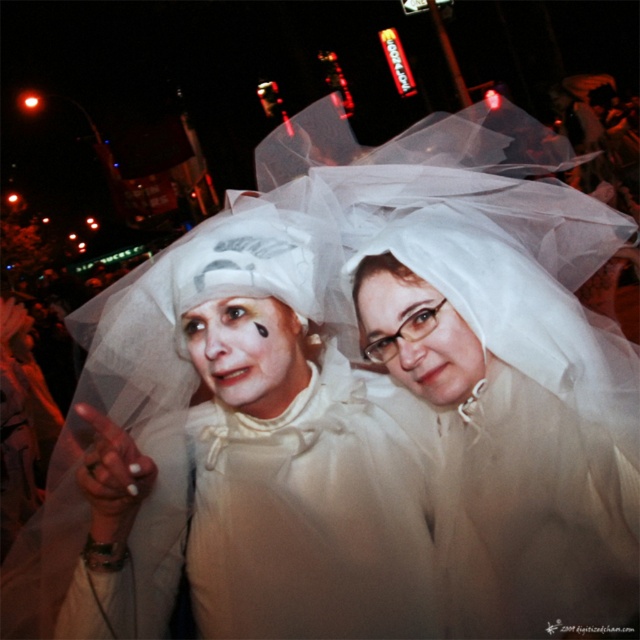
Between white sheer veil at center and translucent white veil at center, which one has less height?

Standing shorter between the two is translucent white veil at center.

Find the location of `white sheer veil at center`. white sheer veil at center is located at coordinates (256, 460).